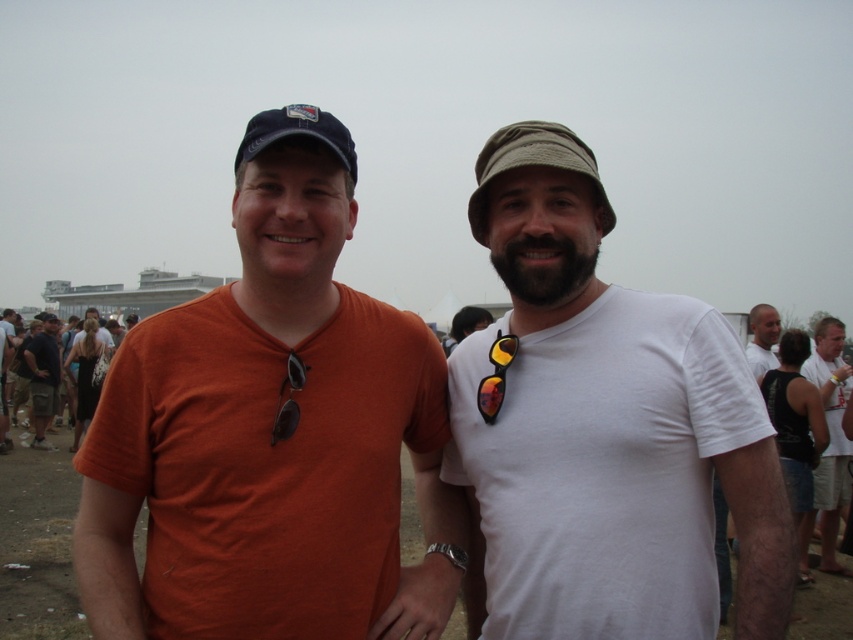
Is orange cotton t-shirt at left taller than light brown hair at right?

Yes.

Is orange cotton t-shirt at left to the left of light brown hair at right from the viewer's perspective?

Correct, you'll find orange cotton t-shirt at left to the left of light brown hair at right.

At what (x,y) coordinates should I click in order to perform the action: click on orange cotton t-shirt at left. Please return your answer as a coordinate pair (x, y). Looking at the image, I should click on (270, 433).

Who is more forward, [315,381] or [28,342]?

Positioned in front is point [315,381].

Can you confirm if orange cotton t-shirt at left is shorter than camouflage-patterned shorts at left?

Incorrect, orange cotton t-shirt at left's height does not fall short of camouflage-patterned shorts at left's.

Measure the distance between orange cotton t-shirt at left and camera.

orange cotton t-shirt at left is 22.58 meters away from camera.

Where is `orange cotton t-shirt at left`? The image size is (853, 640). orange cotton t-shirt at left is located at coordinates (270, 433).

Which is more to the left, orange cotton t-shirt at left or reflective plastic sunglasses at center?

Positioned to the left is orange cotton t-shirt at left.

Who is higher up, orange cotton t-shirt at left or reflective plastic sunglasses at center?

Positioned higher is orange cotton t-shirt at left.

Which is in front, point (376, 456) or point (506, 337)?

Point (376, 456) is more forward.

This screenshot has width=853, height=640. I want to click on orange cotton t-shirt at left, so click(x=270, y=433).